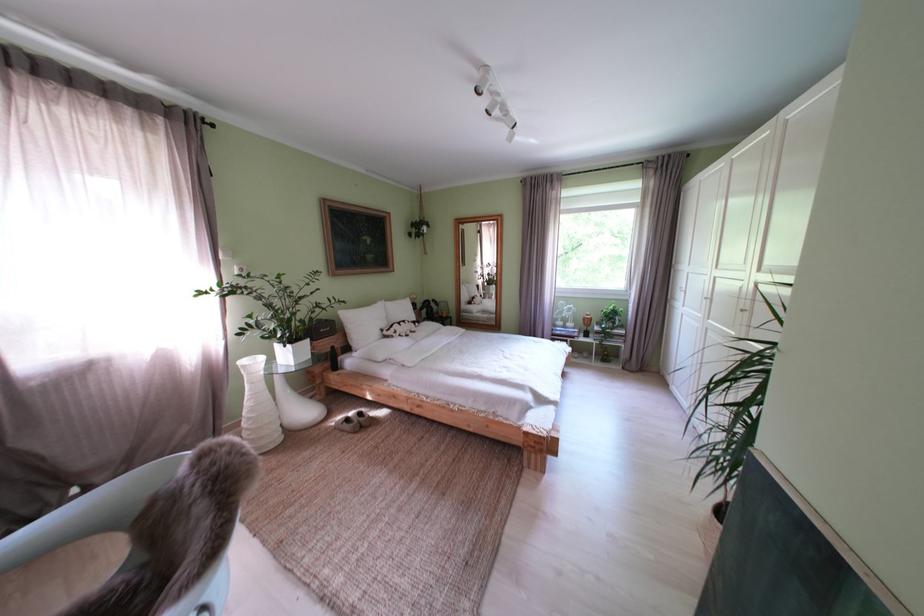
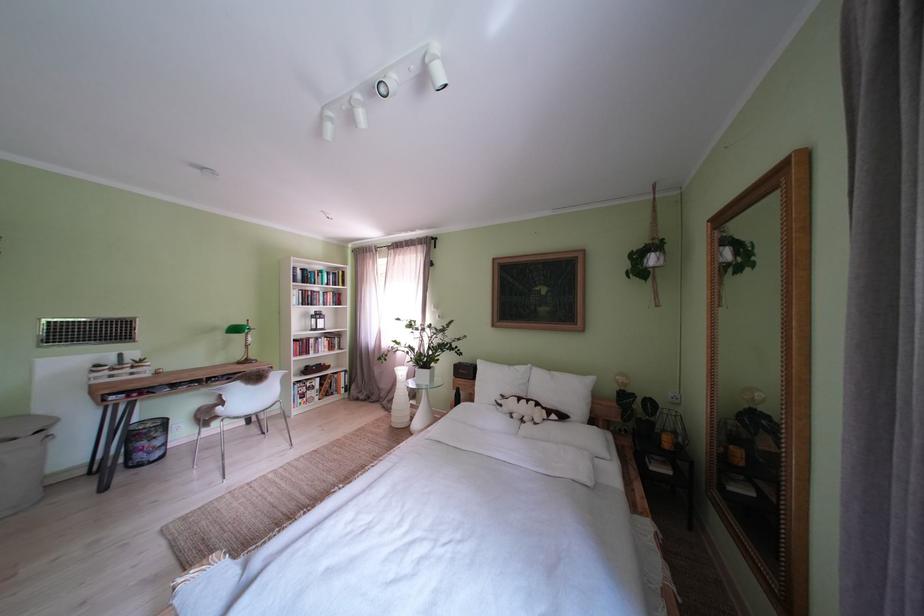
In the second image, find the point that corresponds to the point at 407,338 in the first image.

(512, 411)